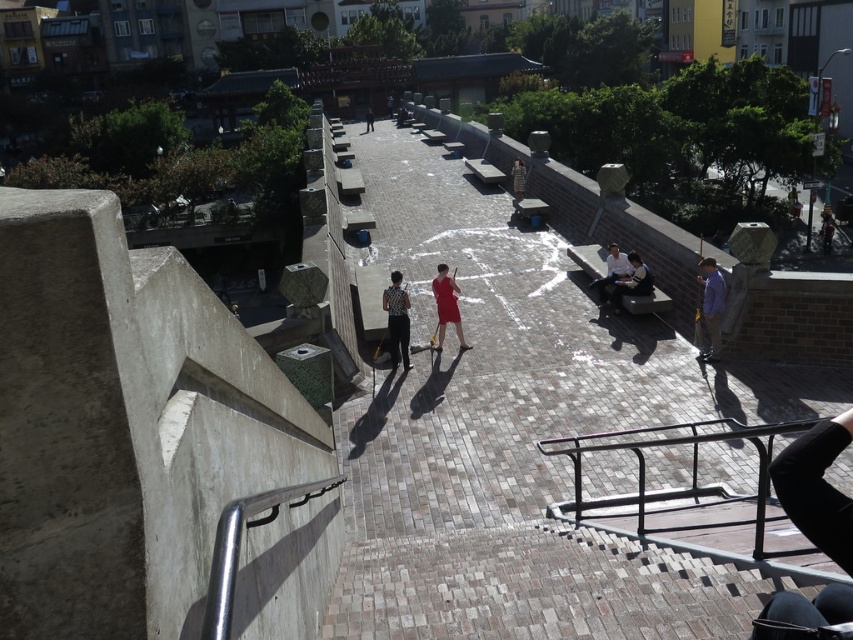
Looking at this image, please look at the image and focus on the point located at coordinates (711, 308). What object is positioned to the right of this point?

The blue fabric shirt at right is positioned to the right of the point located at coordinates (711, 308).